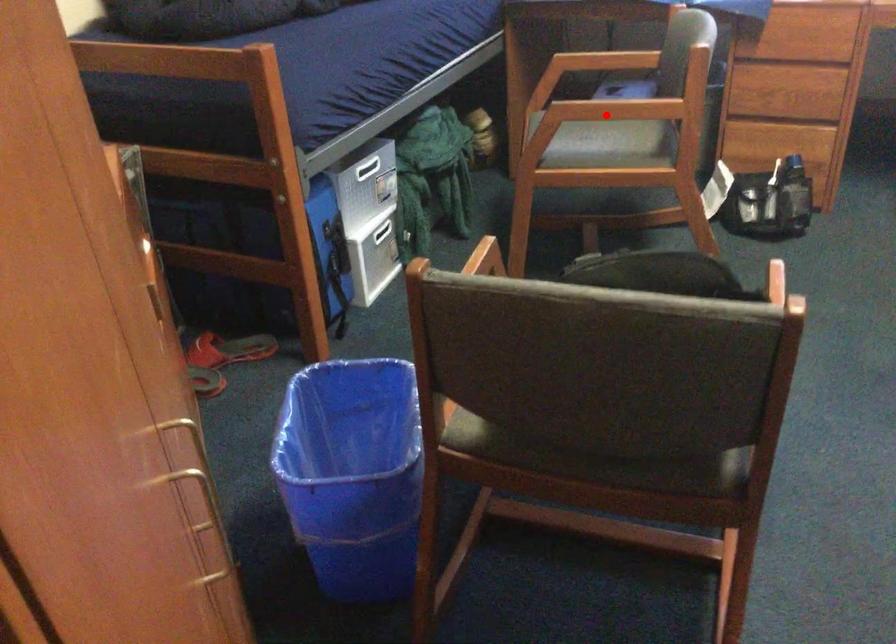
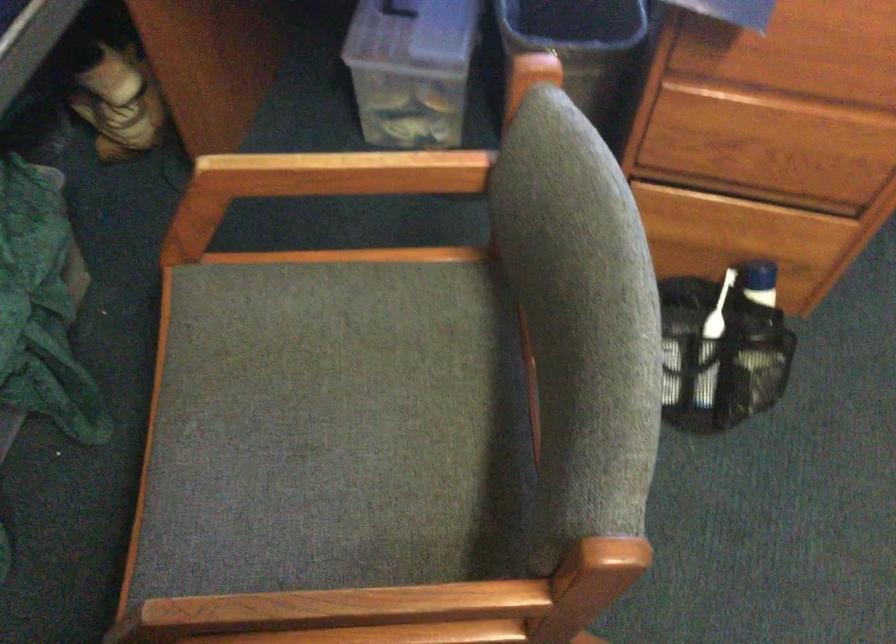
Question: I am providing you with two images of the same scene from different viewpoints. Image1 has a red point marked. In image2, the corresponding 3D location appears at what relative position? Reply with the corresponding letter.

Choices:
 (A) Closer
 (B) Farther

Answer: (A)